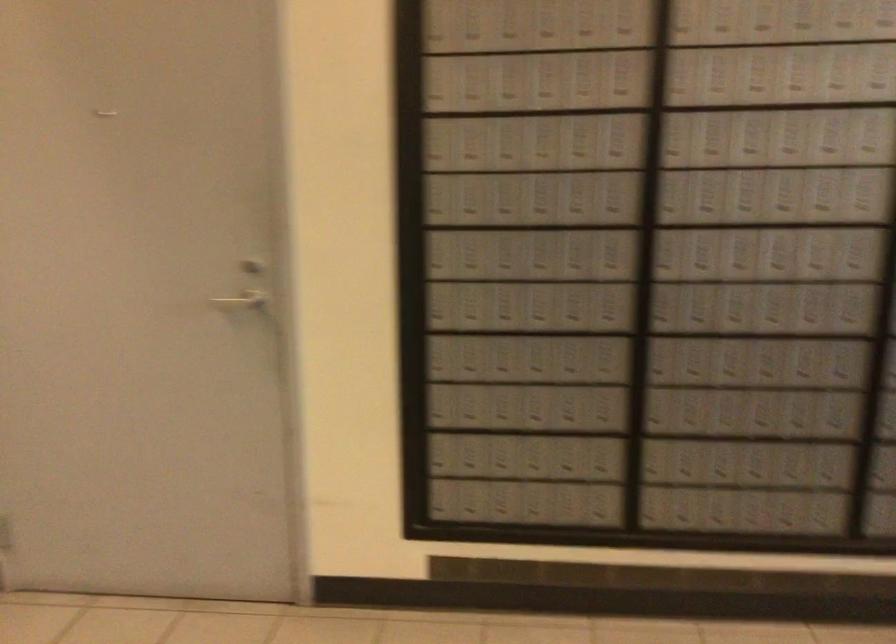
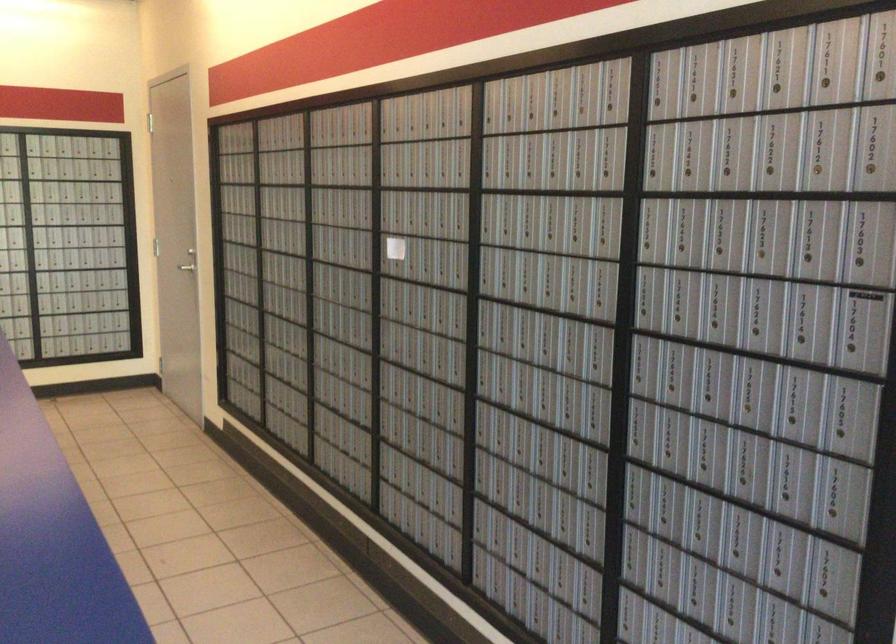
Question: I am providing you with two images of the same scene from different viewpoints. After the viewpoint changes to image2, which objects are now occluded?

Choices:
 (A) silver  door
 (B) metal door handle
 (C) mailbox keyhole
 (D) none of these

Answer: (D)